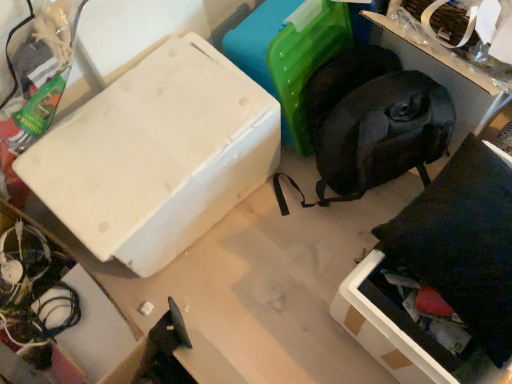
Question: From a real-world perspective, is black fabric bag at upper right positioned above or below white matte box at upper left?

Choices:
 (A) above
 (B) below

Answer: (A)

Question: Considering the positions of black fabric bag at upper right and white matte box at upper left in the image, is black fabric bag at upper right taller or shorter than white matte box at upper left?

Choices:
 (A) short
 (B) tall

Answer: (B)

Question: Considering the real-world distances, which object is farthest from the white matte box at upper left?

Choices:
 (A) black fabric bag at upper right
 (B) white matte cardboard box at lower left

Answer: (A)

Question: Based on their relative distances, which object is nearer to the white matte cardboard box at lower left?

Choices:
 (A) white matte box at upper left
 (B) black fabric bag at upper right

Answer: (A)